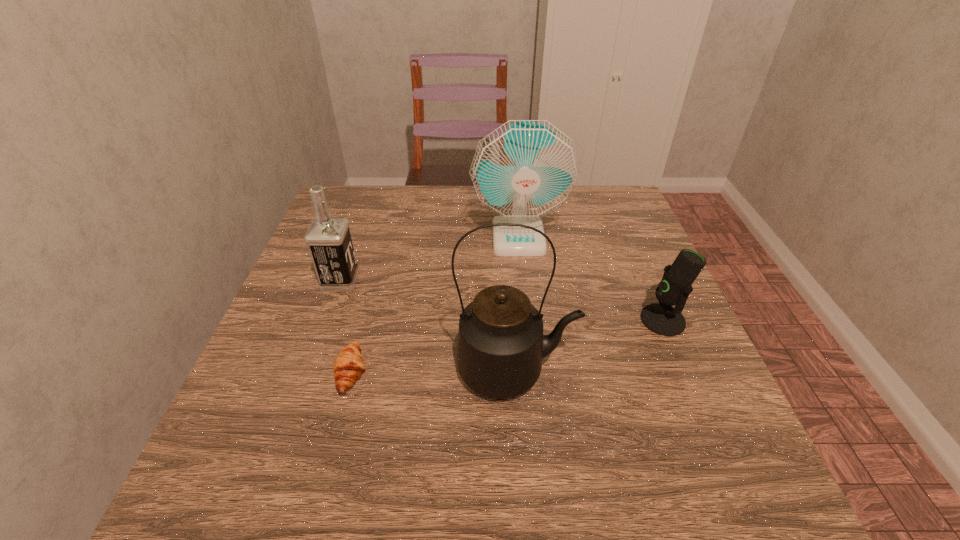
Image resolution: width=960 pixels, height=540 pixels. What are the coordinates of `vacant position in the image that satisfies the following two spatial constraints: 1. on the front label of the fourth nearest object; 2. on the right side of the second shortest object` in the screenshot? It's located at click(x=326, y=320).

Where is `vacant space that satisfies the following two spatial constraints: 1. in front of the fan to face the airflow; 2. spout on the kettle`? This screenshot has height=540, width=960. vacant space that satisfies the following two spatial constraints: 1. in front of the fan to face the airflow; 2. spout on the kettle is located at coordinates (533, 370).